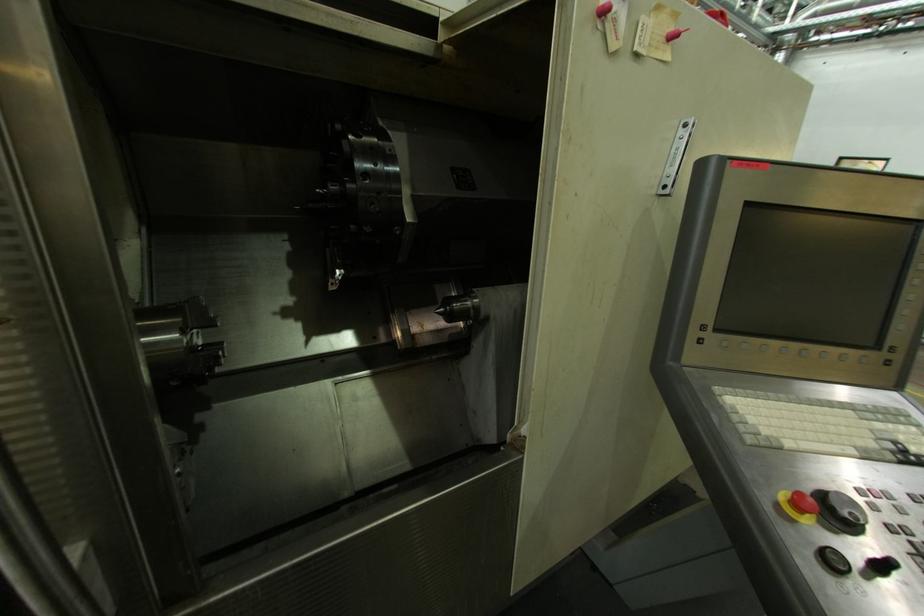
Describe the element at coordinates (459, 308) in the screenshot. This screenshot has width=924, height=616. I see `the large black knob` at that location.